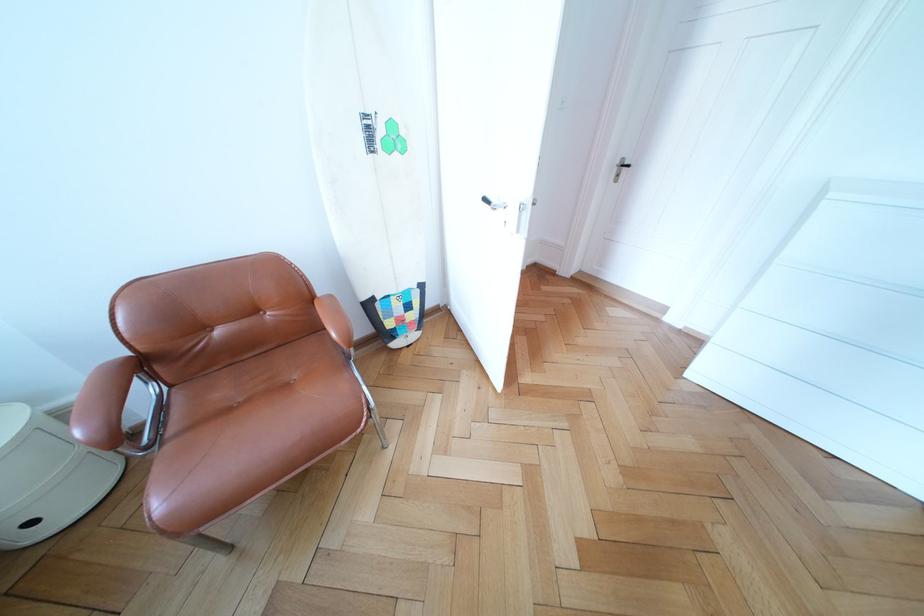
You are a GUI agent. You are given a task and a screenshot of the screen. Output one action in this format:
    pyautogui.click(x=<x>, y=<y>)
    Task: Click on the silver door handle
    The height and width of the screenshot is (616, 924).
    Given the screenshot: What is the action you would take?
    pyautogui.click(x=625, y=164)